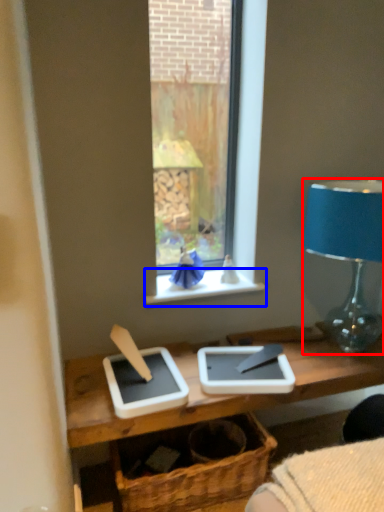
Question: Among these objects, which one is nearest to the camera, lamp (highlighted by a red box) or window sill (highlighted by a blue box)?

Choices:
 (A) lamp
 (B) window sill

Answer: (A)